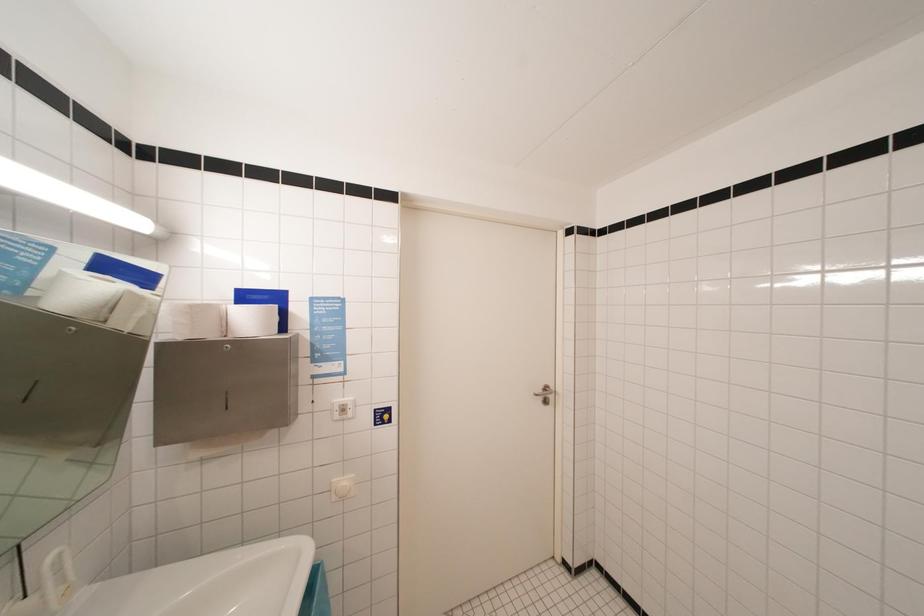
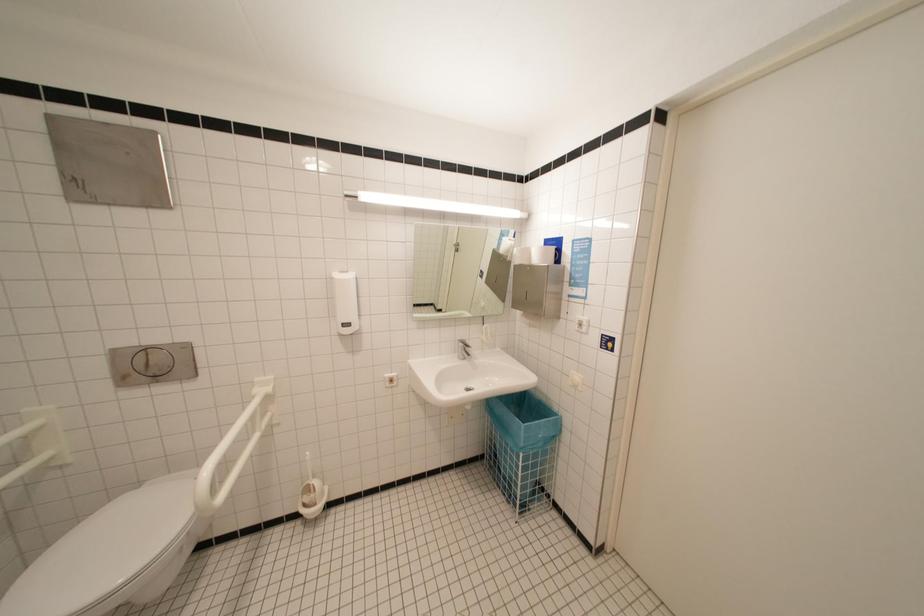
Question: The first image is from the beginning of the video and the second image is from the end. How did the camera likely rotate when shooting the video?

Choices:
 (A) Left
 (B) Right
 (C) Up
 (D) Down

Answer: (A)